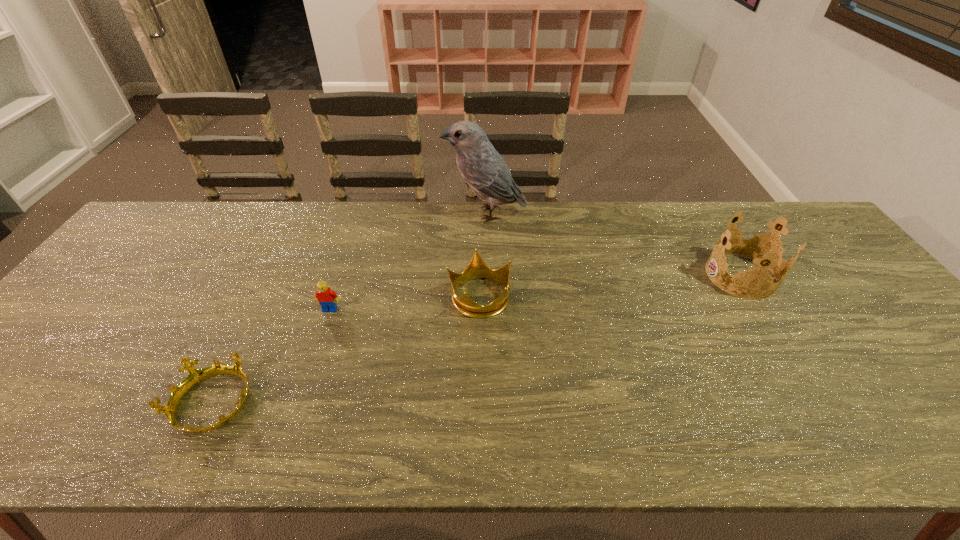
Identify the location of blank space located 0.130m on the front-facing side of the tallest object. This screenshot has width=960, height=540. (404, 213).

At what (x,y) coordinates should I click in order to perform the action: click on free point located on the front of the rightmost crown. Please return your answer as a coordinate pair (x, y). Looking at the image, I should click on (778, 335).

Locate an element on the screen. This screenshot has height=540, width=960. vacant region located on the face of the fourth object from right to left is located at coordinates (299, 406).

At what (x,y) coordinates should I click in order to perform the action: click on free space located 0.380m on the left of the second crown from right to left. Please return your answer as a coordinate pair (x, y). The image size is (960, 540). Looking at the image, I should click on coord(307,296).

I want to click on free location located 0.170m on the left of the nearest object, so click(x=95, y=403).

At what (x,y) coordinates should I click in order to perform the action: click on object situated at the far edge. Please return your answer as a coordinate pair (x, y). Image resolution: width=960 pixels, height=540 pixels. Looking at the image, I should click on (485, 171).

Locate an element on the screen. The image size is (960, 540). object that is at the near edge is located at coordinates (195, 376).

This screenshot has height=540, width=960. I want to click on vacant space at the far edge of the desktop, so click(x=533, y=206).

In the image, there is a desktop. In order to click on vacant region at the near edge in this screenshot , I will do `click(350, 434)`.

Image resolution: width=960 pixels, height=540 pixels. Identify the location of vacant space at the far left corner of the desktop. (189, 236).